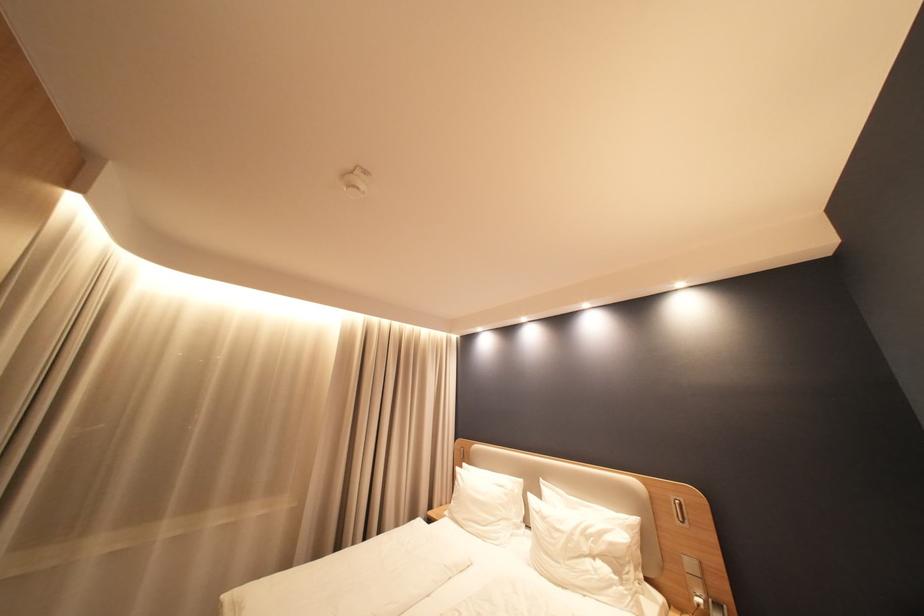
Locate an element on the screen. The image size is (924, 616). headboard light switch is located at coordinates (693, 573).